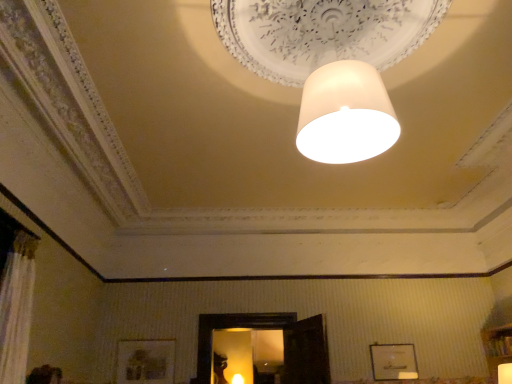
Question: In which direction should I rotate to look at wooden picture frame at lower center, the 1th picture frame positioned from the left?

Choices:
 (A) right
 (B) left

Answer: (B)

Question: Is the depth of matte white lampshade at upper center, placed as the second lamp when sorted from back to front, greater than that of white matte picture frame at lower right, which ranks as the second picture frame in left-to-right order?

Choices:
 (A) no
 (B) yes

Answer: (A)

Question: Could you tell me if matte white lampshade at upper center, which ranks as the third lamp in left-to-right order, is facing white matte picture frame at lower right, which ranks as the second picture frame in left-to-right order?

Choices:
 (A) yes
 (B) no

Answer: (A)

Question: Is matte white lampshade at upper center, which is the 2th lamp from front to back, bigger than white matte picture frame at lower right, which ranks as the second picture frame in left-to-right order?

Choices:
 (A) yes
 (B) no

Answer: (B)

Question: Can you confirm if matte white lampshade at upper center, arranged as the second lamp when ordered from the bottom, is positioned to the left of white matte picture frame at lower right, which ranks as the second picture frame in left-to-right order?

Choices:
 (A) yes
 (B) no

Answer: (B)

Question: Is matte white lampshade at upper center, arranged as the second lamp when ordered from the bottom, smaller than white matte picture frame at lower right, the 1th picture frame viewed from the right?

Choices:
 (A) no
 (B) yes

Answer: (B)

Question: Does matte white lampshade at upper center, arranged as the second lamp when ordered from the bottom, lie in front of white matte picture frame at lower right, the 1th picture frame viewed from the right?

Choices:
 (A) no
 (B) yes

Answer: (B)

Question: Considering the relative sizes of white matte lampshade at center, arranged as the third lamp when ordered from the bottom, and white matte picture frame at lower right, which ranks as the second picture frame in left-to-right order, in the image provided, is white matte lampshade at center, arranged as the third lamp when ordered from the bottom, bigger than white matte picture frame at lower right, which ranks as the second picture frame in left-to-right order,?

Choices:
 (A) no
 (B) yes

Answer: (B)

Question: Is white matte lampshade at center, arranged as the second lamp when viewed from the right, aimed at white matte picture frame at lower right, which ranks as the second picture frame in left-to-right order?

Choices:
 (A) yes
 (B) no

Answer: (A)

Question: From the image's perspective, does white matte lampshade at center, which is counted as the third lamp, starting from the back, appear higher than white matte picture frame at lower right, which ranks as the second picture frame in left-to-right order?

Choices:
 (A) yes
 (B) no

Answer: (A)

Question: Can we say white matte lampshade at center, arranged as the second lamp when viewed from the right, lies outside white matte picture frame at lower right, which ranks as the second picture frame in left-to-right order?

Choices:
 (A) yes
 (B) no

Answer: (A)

Question: Is white matte lampshade at center, which is counted as the third lamp, starting from the back, closer to camera compared to white matte picture frame at lower right, which ranks as the second picture frame in left-to-right order?

Choices:
 (A) yes
 (B) no

Answer: (A)

Question: Is white matte lampshade at center, which is counted as the third lamp, starting from the back, surrounding white matte picture frame at lower right, which ranks as the second picture frame in left-to-right order?

Choices:
 (A) no
 (B) yes

Answer: (A)

Question: Considering the relative positions of white matte lampshade at center, the 1th lamp when ordered from front to back, and matte white lampshade at upper center, placed as the second lamp when sorted from back to front, in the image provided, is white matte lampshade at center, the 1th lamp when ordered from front to back, to the right of matte white lampshade at upper center, placed as the second lamp when sorted from back to front, from the viewer's perspective?

Choices:
 (A) no
 (B) yes

Answer: (A)